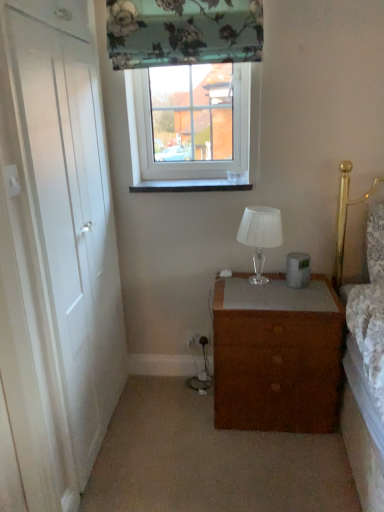
Question: Is clear glass window at upper center far away from white glass lamp at center?

Choices:
 (A) no
 (B) yes

Answer: (A)

Question: Is clear glass window at upper center outside of white glass lamp at center?

Choices:
 (A) yes
 (B) no

Answer: (A)

Question: Does clear glass window at upper center have a smaller size compared to white glass lamp at center?

Choices:
 (A) no
 (B) yes

Answer: (A)

Question: Could you tell me if clear glass window at upper center is turned towards white glass lamp at center?

Choices:
 (A) no
 (B) yes

Answer: (A)

Question: From a real-world perspective, is clear glass window at upper center located higher than white glass lamp at center?

Choices:
 (A) no
 (B) yes

Answer: (B)

Question: Is clear glass window at upper center in front of white glass lamp at center?

Choices:
 (A) yes
 (B) no

Answer: (B)

Question: Does white glossy window sill at center have a greater height compared to clear glass window at upper center?

Choices:
 (A) yes
 (B) no

Answer: (B)

Question: Is white glossy window sill at center thinner than clear glass window at upper center?

Choices:
 (A) yes
 (B) no

Answer: (B)

Question: Are white glossy window sill at center and clear glass window at upper center located far from each other?

Choices:
 (A) no
 (B) yes

Answer: (A)

Question: Does white glossy window sill at center appear on the right side of clear glass window at upper center?

Choices:
 (A) no
 (B) yes

Answer: (A)

Question: From a real-world perspective, is white glossy window sill at center on top of clear glass window at upper center?

Choices:
 (A) yes
 (B) no

Answer: (B)

Question: Does white glossy window sill at center have a smaller size compared to clear glass window at upper center?

Choices:
 (A) no
 (B) yes

Answer: (B)

Question: Is floral fabric curtain at upper center surrounding brown matte chest of drawers at center?

Choices:
 (A) yes
 (B) no

Answer: (B)